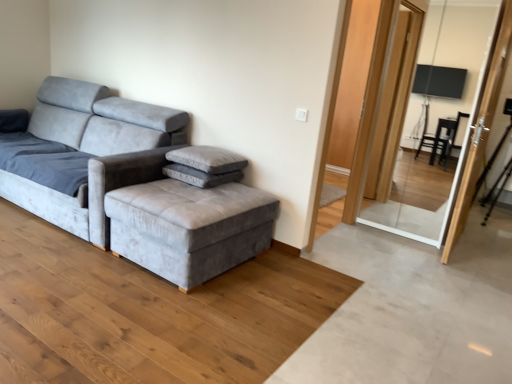
The width and height of the screenshot is (512, 384). In order to click on free space that is to the left of matte black screen door at upper right, which is counted as the second screen door, starting from the left in this screenshot , I will do (x=407, y=245).